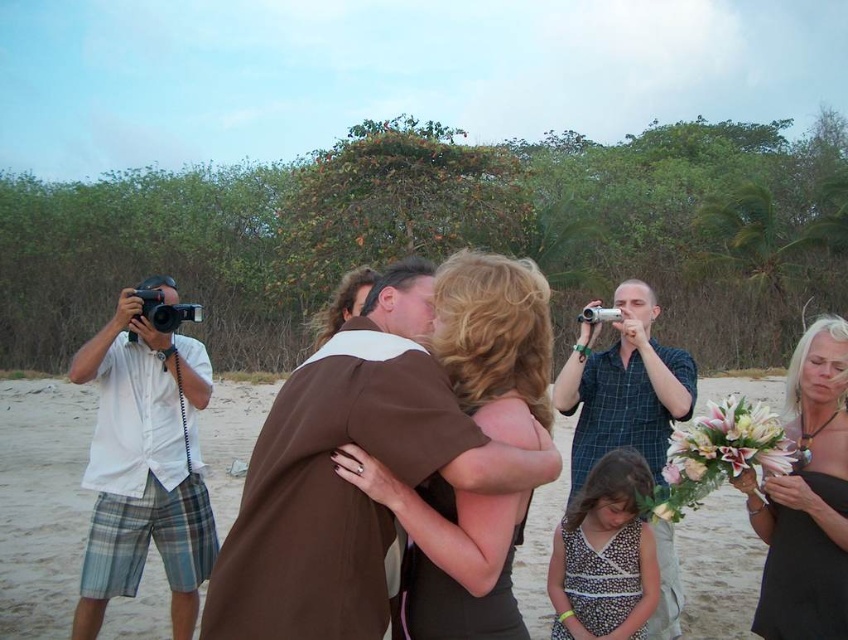
You are a photographer at the beach scene. You need to place a small tripod between the white shirt at left and the white floral bouquet at right. According to the scene description, where should you position the tripod?

The white shirt at left is positioned on the left side of the white floral bouquet at right, so the tripod should be placed between them, to the right of the white shirt at left and to the left of the white floral bouquet at right.

You are a photographer at the beach scene. You see the matte brown dress at center and the silver metallic digital camera at center. Which object is positioned lower in the image?

The matte brown dress at center is located below the silver metallic digital camera at center, so the matte brown dress at center is positioned lower in the image.

You are standing at the point marked as point (x=144, y=467). Looking around, you see a white shirt at left. Is the white shirt at left closer to you or farther away compared to the couple?

The white shirt at left is farther away from you than the couple because it is positioned to the left of the point where you are standing.